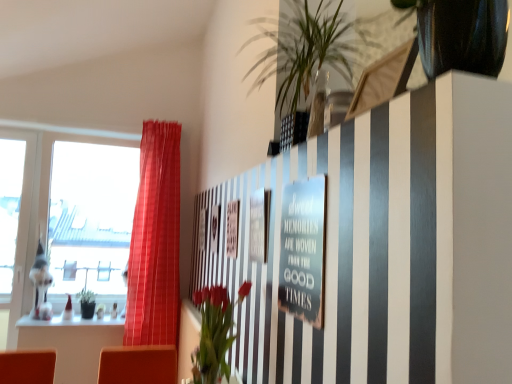
Find the location of a particular element. The height and width of the screenshot is (384, 512). transparent glass window at left is located at coordinates (70, 213).

Is matte glass vase at upper center oriented towards vivid red flowers at center?

No, matte glass vase at upper center does not turn towards vivid red flowers at center.

Visually, is matte glass vase at upper center positioned to the left or to the right of vivid red flowers at center?

From the image, it's evident that matte glass vase at upper center is to the right of vivid red flowers at center.

Find the location of a particular element. This screenshot has height=384, width=512. vase that appears on the right of vivid red flowers at center is located at coordinates (318, 104).

Considering the positions of points (313, 129) and (225, 333), is point (313, 129) farther from camera compared to point (225, 333)?

That is False.

Is vivid red flowers at center not within transparent glass window at left?

Absolutely, vivid red flowers at center is external to transparent glass window at left.

From the image's perspective, is vivid red flowers at center on transparent glass window at left?

No.

Is vivid red flowers at center looking in the opposite direction of transparent glass window at left?

vivid red flowers at center is not turned away from transparent glass window at left.

In terms of width, does vivid red flowers at center look wider or thinner when compared to transparent glass window at left?

In the image, vivid red flowers at center appears to be more narrow than transparent glass window at left.

Considering the relative sizes of green leafy plant at upper center and vivid red flowers at center in the image provided, is green leafy plant at upper center taller than vivid red flowers at center?

Yes, green leafy plant at upper center is taller than vivid red flowers at center.

Considering the sizes of objects green leafy plant at upper center and vivid red flowers at center in the image provided, who is bigger, green leafy plant at upper center or vivid red flowers at center?

green leafy plant at upper center.

Does green leafy plant at upper center lie in front of vivid red flowers at center?

Yes, the depth of green leafy plant at upper center is less than that of vivid red flowers at center.

Can you tell me how much matte red curtain at left and transparent glass window at left differ in facing direction?

The facing directions of matte red curtain at left and transparent glass window at left are 1.07 degrees apart.

Is matte red curtain at left at the left side of transparent glass window at left?

Incorrect, matte red curtain at left is not on the left side of transparent glass window at left.

Is the surface of matte red curtain at left in direct contact with transparent glass window at left?

There is a gap between matte red curtain at left and transparent glass window at left.

From the image's perspective, is vivid red flowers at center under green leafy plant at upper center?

Yes.

Is vivid red flowers at center taller or shorter than green leafy plant at upper center?

vivid red flowers at center is shorter than green leafy plant at upper center.

Which object is closer to the camera taking this photo, vivid red flowers at center or green leafy plant at upper center?

green leafy plant at upper center is closer to the camera.

Looking at their sizes, would you say vivid red flowers at center is wider or thinner than green leafy plant at upper center?

vivid red flowers at center is thinner than green leafy plant at upper center.

From a real-world perspective, is vivid red flowers at center under matte glass vase at upper center?

Correct, in the physical world, vivid red flowers at center is lower than matte glass vase at upper center.

In order to click on vase located above the vivid red flowers at center (from a real-world perspective) in this screenshot , I will do `click(318, 104)`.

In the scene shown: Can you confirm if matte glass vase at upper center is smaller than green leafy plant at upper center?

Correct, matte glass vase at upper center occupies less space than green leafy plant at upper center.

Considering the relative sizes of matte glass vase at upper center and green leafy plant at upper center in the image provided, is matte glass vase at upper center taller than green leafy plant at upper center?

No, matte glass vase at upper center is not taller than green leafy plant at upper center.

The image size is (512, 384). Identify the location of houseplant above the matte glass vase at upper center (from a real-world perspective). (306, 55).

Is matte glass vase at upper center at the right side of green leafy plant at upper center?

Indeed, matte glass vase at upper center is positioned on the right side of green leafy plant at upper center.

The height and width of the screenshot is (384, 512). In order to click on floral arrangement that appears behind the matte glass vase at upper center in this screenshot , I will do `click(214, 332)`.

You are a GUI agent. You are given a task and a screenshot of the screen. Output one action in this format:
    pyautogui.click(x=<x>, y=<y>)
    Task: Click on the floral arrangement in front of the transparent glass window at left
    
    Given the screenshot: What is the action you would take?
    pyautogui.click(x=214, y=332)

When comparing their distances from vivid red flowers at center, does matte glass vase at upper center or metallic silver sign at center seem further?

Based on the image, matte glass vase at upper center appears to be further to vivid red flowers at center.

Based on their spatial positions, is metallic silver sign at center or matte glass vase at upper center closer to matte red curtain at left?

Among the two, metallic silver sign at center is located nearer to matte red curtain at left.

Estimate the real-world distances between objects in this image. Which object is closer to matte glass vase at upper center, matte red curtain at left or transparent glass window at left?

matte red curtain at left lies closer to matte glass vase at upper center than the other object.

Looking at the image, which one is located closer to metallic silver sign at center, vivid red flowers at center or matte red curtain at left?

Based on the image, vivid red flowers at center appears to be nearer to metallic silver sign at center.

Looking at the image, which one is located closer to matte glass vase at upper center, metallic silver sign at center or matte red curtain at left?

metallic silver sign at center is closer to matte glass vase at upper center.

When comparing their distances from metallic silver sign at center, does green leafy plant at upper center or vivid red flowers at center seem closer?

Based on the image, vivid red flowers at center appears to be nearer to metallic silver sign at center.

Based on their spatial positions, is vivid red flowers at center or matte glass vase at upper center closer to transparent glass window at left?

Based on the image, vivid red flowers at center appears to be nearer to transparent glass window at left.

When comparing their distances from metallic silver sign at center, does transparent glass window at left or matte glass vase at upper center seem closer?

Among the two, matte glass vase at upper center is located nearer to metallic silver sign at center.

The image size is (512, 384). In order to click on writing between matte glass vase at upper center and vivid red flowers at center from top to bottom in this screenshot , I will do `click(302, 253)`.

Find the location of a particular element. The height and width of the screenshot is (384, 512). vase between green leafy plant at upper center and matte red curtain at left along the z-axis is located at coordinates pyautogui.click(x=318, y=104).

The height and width of the screenshot is (384, 512). I want to click on curtain located between matte glass vase at upper center and transparent glass window at left in the depth direction, so click(x=155, y=240).

This screenshot has width=512, height=384. What are the coordinates of `floral arrangement positioned between green leafy plant at upper center and matte red curtain at left from near to far` in the screenshot? It's located at (214, 332).